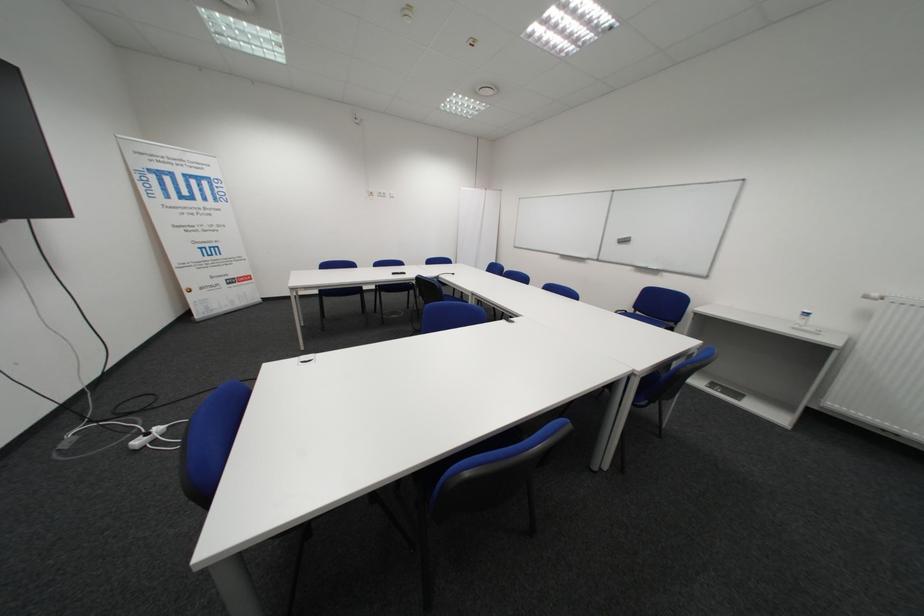
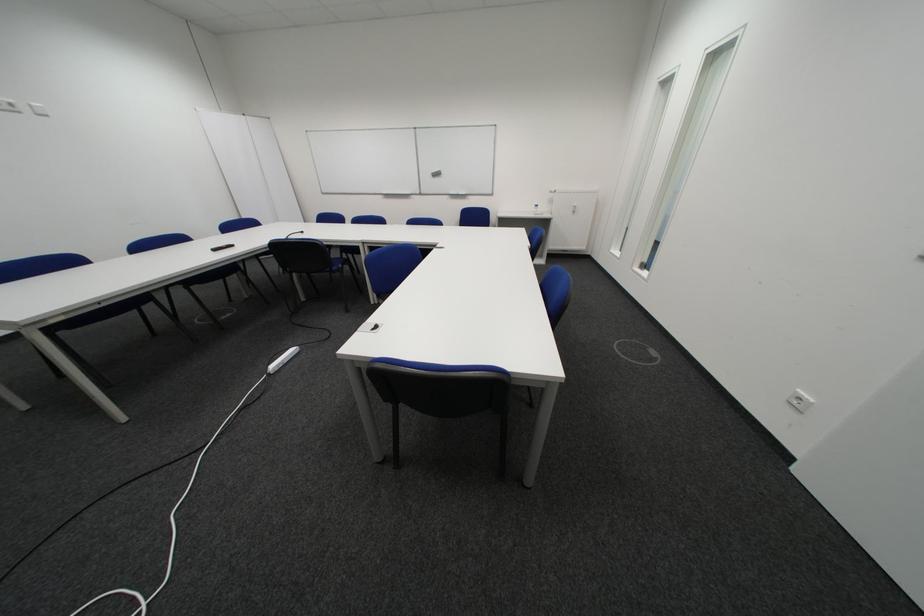
Where in the second image is the point corresponding to point (391, 196) from the first image?

(8, 108)